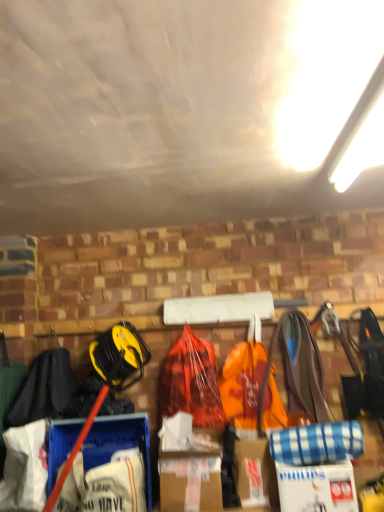
Describe the element at coordinates (317, 487) in the screenshot. The height and width of the screenshot is (512, 384). I see `white cardboard box at lower right` at that location.

Measure the distance between orange plastic bag at center and camera.

orange plastic bag at center is 1.83 meters from camera.

This screenshot has height=512, width=384. I want to click on white cardboard box at lower right, so click(317, 487).

Identify the location of cardboard box located on the right of orange plastic bag at center. (317, 487).

From the image's perspective, which one is positioned lower, white cardboard box at lower right or orange plastic bag at center?

white cardboard box at lower right, from the image's perspective.

How different are the orientations of white cardboard box at lower right and orange plastic bag at center in degrees?

They differ by 7.41 degrees in their facing directions.

Is white cardboard box at lower right positioned with its back to orange plastic bag at center?

No, white cardboard box at lower right is not facing the opposite direction of orange plastic bag at center.

Can you confirm if orange plastic bag at center is shorter than black fabric at left?

Incorrect, the height of orange plastic bag at center does not fall short of that of black fabric at left.

Considering the positions of objects orange plastic bag at center and black fabric at left in the image provided, who is more to the left, orange plastic bag at center or black fabric at left?

black fabric at left.

From the picture: Which of these two, orange plastic bag at center or black fabric at left, is smaller?

orange plastic bag at center is smaller.

Is orange plastic bag at center outside of black fabric at left?

orange plastic bag at center is positioned outside black fabric at left.

Where is `grocery bag above the white cardboard box at lower right (from a real-world perspective)`? The image size is (384, 512). grocery bag above the white cardboard box at lower right (from a real-world perspective) is located at coordinates (243, 383).

Which object is positioned more to the left, white cardboard box at lower right or orange plastic bag at center?

orange plastic bag at center is more to the left.

Is white cardboard box at lower right not near orange plastic bag at center?

Actually, white cardboard box at lower right and orange plastic bag at center are a little close together.

From the image's perspective, relative to white cardboard box at lower right, is black fabric at left above or below?

Based on their image positions, black fabric at left is located above white cardboard box at lower right.

From a real-world perspective, is black fabric at left located higher than white cardboard box at lower right?

Yes, from a real-world perspective, black fabric at left is on top of white cardboard box at lower right.

Between black fabric at left and white cardboard box at lower right, which one has larger width?

black fabric at left is wider.

Between black fabric at left and white cardboard box at lower right, which one has more height?

With more height is black fabric at left.

Considering the relative sizes of orange plastic bag at center and orange plastic bag at center in the image provided, is orange plastic bag at center thinner than orange plastic bag at center?

Yes.

From the image's perspective, relative to orange plastic bag at center, is orange plastic bag at center above or below?

From the image's perspective, orange plastic bag at center appears below orange plastic bag at center.

The image size is (384, 512). Find the location of `grocery bag lying on the right of orange plastic bag at center`. grocery bag lying on the right of orange plastic bag at center is located at coordinates [243, 383].

Would you say orange plastic bag at center is a long distance from orange plastic bag at center?

No.

Which is correct: black fabric at left is inside orange plastic bag at center, or outside of it?

The correct answer is: outside.

Based on their sizes in the image, would you say black fabric at left is bigger or smaller than orange plastic bag at center?

In the image, black fabric at left appears to be larger than orange plastic bag at center.

How different are the orientations of black fabric at left and orange plastic bag at center in degrees?

2.37 degrees.

Is black fabric at left in front of or behind orange plastic bag at center in the image?

Visually, black fabric at left is located in front of orange plastic bag at center.

From the image's perspective, which object appears higher, white cardboard box at lower right or black fabric at left?

black fabric at left is shown above in the image.

Could you tell me if white cardboard box at lower right is turned towards black fabric at left?

No, white cardboard box at lower right does not turn towards black fabric at left.

Which is behind, point (287, 493) or point (29, 381)?

Point (29, 381)

Where is `backpack above the white cardboard box at lower right (from a real-world perspective)`? Image resolution: width=384 pixels, height=512 pixels. backpack above the white cardboard box at lower right (from a real-world perspective) is located at coordinates (191, 382).

In the image, there is a orange plastic bag at center. Where is `clothing below it (from the image's perspective)`? This screenshot has height=512, width=384. clothing below it (from the image's perspective) is located at coordinates (44, 389).

Considering their positions, is black fabric at left positioned further to white cardboard box at lower right than orange plastic bag at center?

black fabric at left is positioned further to the anchor white cardboard box at lower right.

From the image, which object appears to be nearer to orange plastic bag at center, black fabric at left or white cardboard box at lower right?

white cardboard box at lower right is closer to orange plastic bag at center.

When comparing their distances from white cardboard box at lower right, does orange plastic bag at center or black fabric at left seem closer?

orange plastic bag at center.

Looking at the image, which one is located further to orange plastic bag at center, white cardboard box at lower right or orange plastic bag at center?

Among the two, white cardboard box at lower right is located further to orange plastic bag at center.

When comparing their distances from orange plastic bag at center, does orange plastic bag at center or white cardboard box at lower right seem further?

white cardboard box at lower right is positioned further to the anchor orange plastic bag at center.

Which object lies nearer to the anchor point orange plastic bag at center, orange plastic bag at center or white cardboard box at lower right?

orange plastic bag at center is positioned closer to the anchor orange plastic bag at center.

From the image, which object appears to be nearer to orange plastic bag at center, white cardboard box at lower right or orange plastic bag at center?

The object closer to orange plastic bag at center is orange plastic bag at center.

Estimate the real-world distances between objects in this image. Which object is closer to orange plastic bag at center, black fabric at left or white cardboard box at lower right?

white cardboard box at lower right lies closer to orange plastic bag at center than the other object.

Locate an element on the screen. The image size is (384, 512). backpack between black fabric at left and white cardboard box at lower right in the horizontal direction is located at coordinates (191, 382).

Locate an element on the screen. The image size is (384, 512). grocery bag between black fabric at left and white cardboard box at lower right is located at coordinates (243, 383).

The width and height of the screenshot is (384, 512). Identify the location of grocery bag between white cardboard box at lower right and orange plastic bag at center from front to back. (x=243, y=383).

The height and width of the screenshot is (512, 384). What are the coordinates of `backpack located between black fabric at left and orange plastic bag at center in the left-right direction` in the screenshot? It's located at (191, 382).